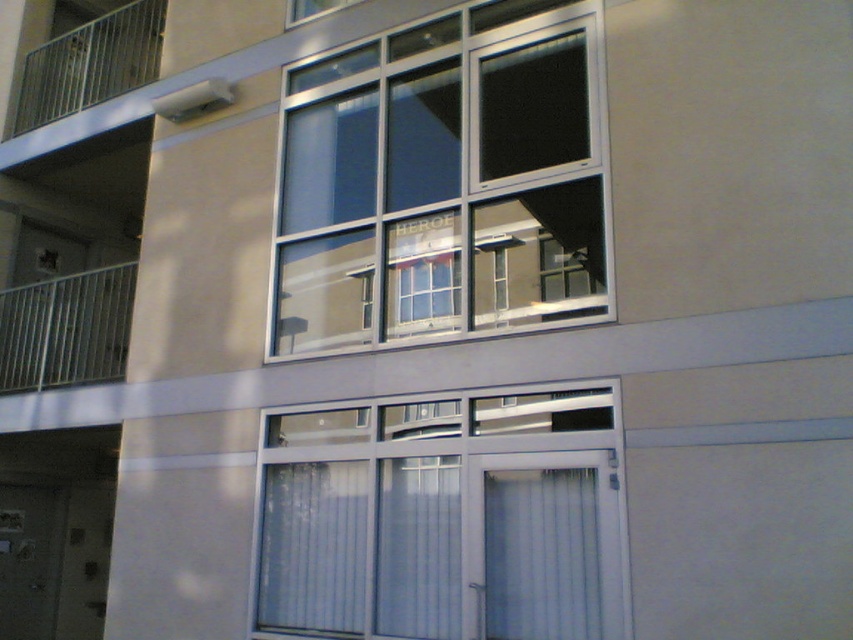
You are standing in front of the building and notice two features on the facade. The white plastic window at center and the white fabric curtain at lower center. Which one is located to the right of the other?

The white plastic window at center is positioned on the right side of white fabric curtain at lower center.

You are standing in front of the building and want to know if the clear glass window at center is wider than the metallic silver balcony at left. Can you determine this based on the scene?

The clear glass window at center is wider than the metallic silver balcony at left according to the description.

You are standing in front of the building and want to locate the clear glass window at center. According to the coordinates provided, where exactly is it positioned?

The clear glass window at center is located at point coordinates (440, 182).